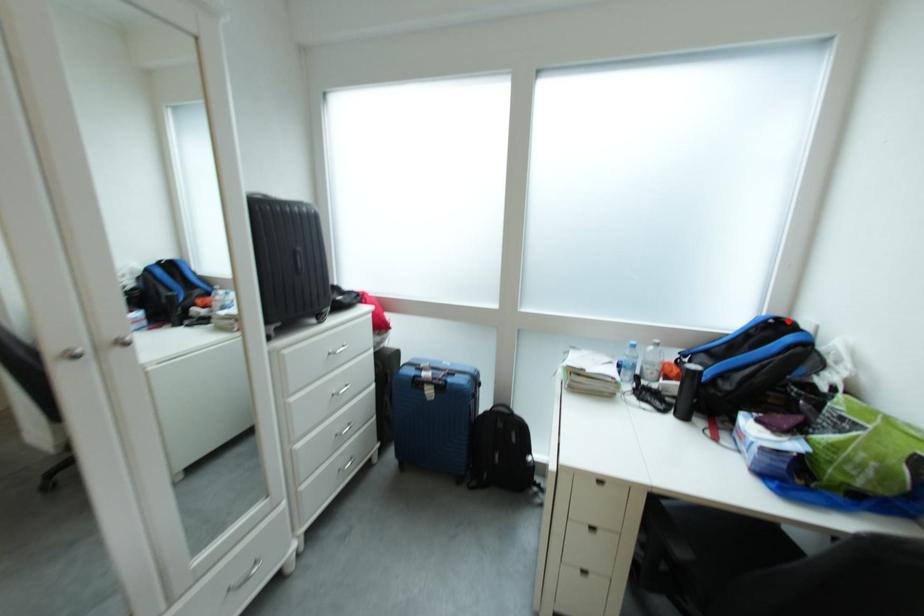
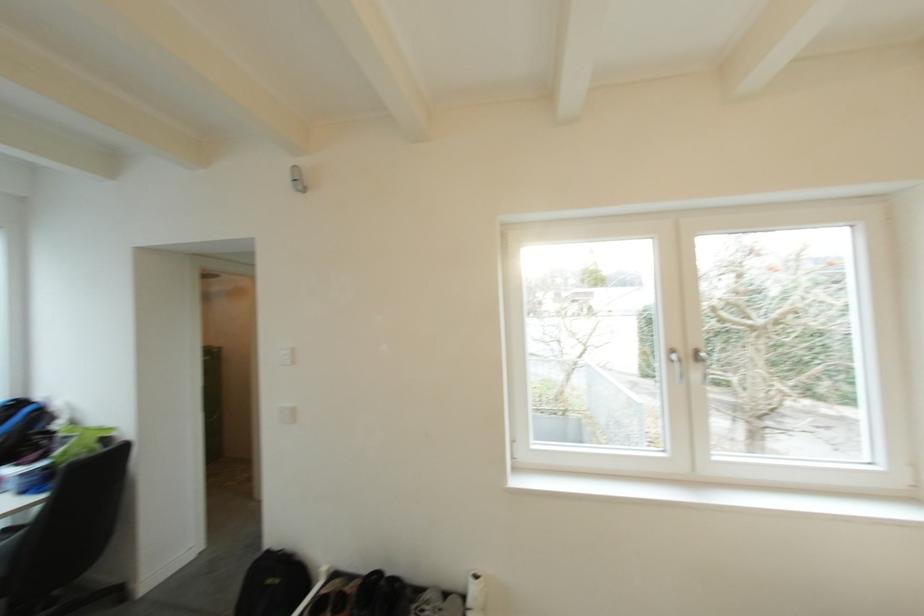
Question: I am providing you with two images of the same scene from different viewpoints. A red point is shown in image1. For the corresponding object point in image2, is it positioned nearer or farther from the camera?

Choices:
 (A) Nearer
 (B) Farther

Answer: (A)